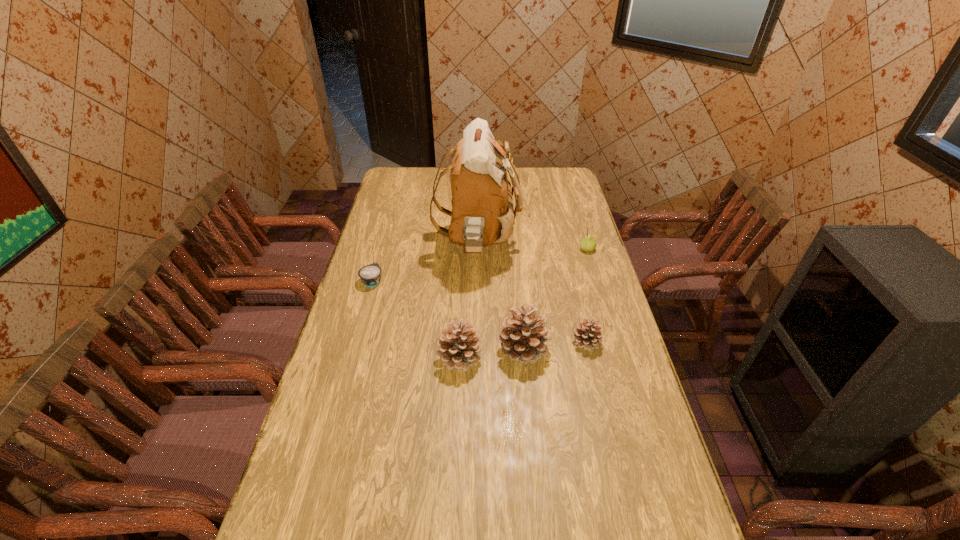
With all pinecones evenly spaced, where should an extra pinecone be placed on the left to continue the pattern? Please point out a vacant space. Please provide its 2D coordinates. Your answer should be formatted as a tuple, i.e. [(x, y)], where the tuple contains the x and y coordinates of a point satisfying the conditions above.

[(394, 366)]